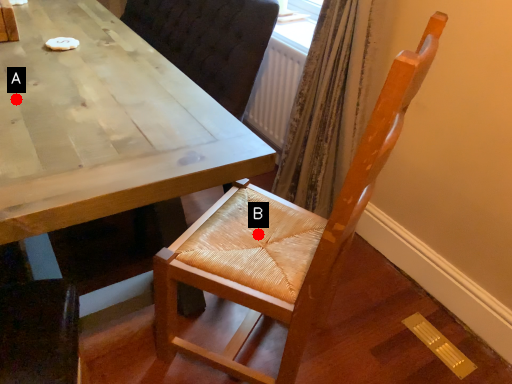
Question: Two points are circled on the image, labeled by A and B beside each circle. Which of the following is the closest to the observer?

Choices:
 (A) A is closer
 (B) B is closer

Answer: (A)